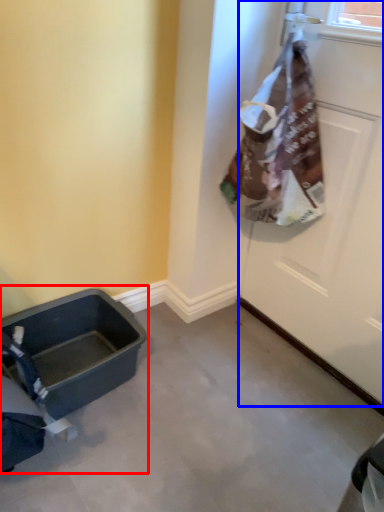
Question: Which of the following is the farthest to the observer, baby carriage (highlighted by a red box) or door (highlighted by a blue box)?

Choices:
 (A) baby carriage
 (B) door

Answer: (A)